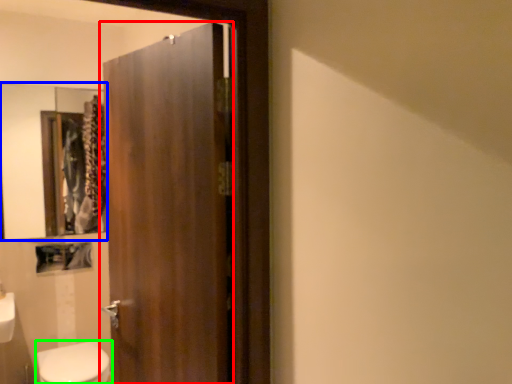
Question: Which is farther away from door (highlighted by a red box)? mirror (highlighted by a blue box) or bidet (highlighted by a green box)?

Choices:
 (A) mirror
 (B) bidet

Answer: (A)